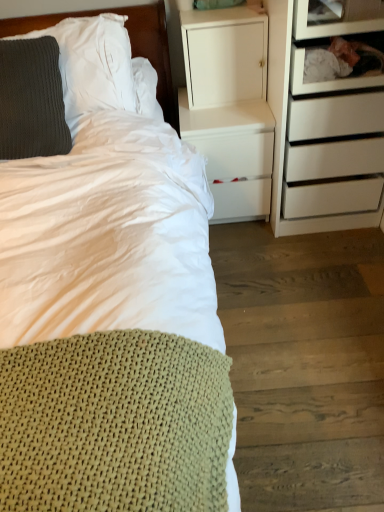
Question: From a real-world perspective, relative to knitted gray pillow at left, which ranks as the 2th pillow in bottom-to-top order, is dark gray knitted pillow at upper left, the 2th pillow from the top, vertically above or below?

Choices:
 (A) above
 (B) below

Answer: (B)

Question: Based on their positions, is dark gray knitted pillow at upper left, the 2th pillow from the top, located to the left or right of knitted gray pillow at left, which ranks as the 2th pillow in bottom-to-top order?

Choices:
 (A) right
 (B) left

Answer: (B)

Question: Which is nearer to the dark gray knitted pillow at upper left, positioned as the 1th pillow in bottom-to-top order?

Choices:
 (A) white matte cabinet at upper center
 (B) white matte nightstand at center
 (C) knitted green blanket at lower left
 (D) wooden drawer at upper right, positioned as the 1th shelf in bottom-to-top order
 (E) transparent glass shelf at upper right, the second shelf ordered from the bottom

Answer: (C)

Question: Which is nearer to the knitted gray pillow at left, which ranks as the 2th pillow in bottom-to-top order?

Choices:
 (A) white matte nightstand at center
 (B) transparent glass shelf at upper right, the second shelf ordered from the bottom
 (C) dark gray knitted pillow at upper left, positioned as the 1th pillow in bottom-to-top order
 (D) knitted green blanket at lower left
 (E) wooden drawer at upper right, positioned as the 1th shelf in bottom-to-top order

Answer: (C)